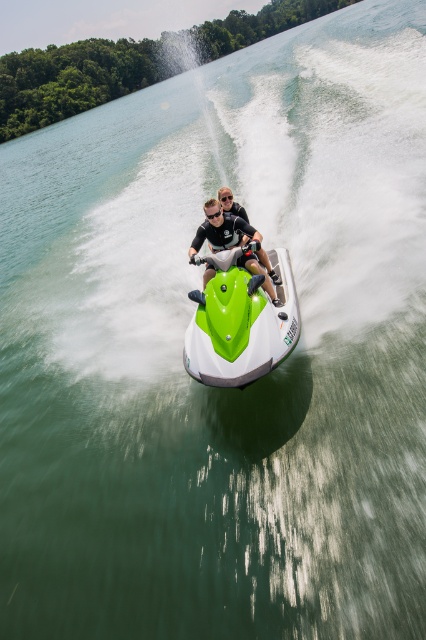
Question: From the image, what is the correct spatial relationship of green matte jet ski at center in relation to matte black helmet at center?

Choices:
 (A) below
 (B) above

Answer: (A)

Question: Is green matte jet ski at center bigger than matte black helmet at center?

Choices:
 (A) yes
 (B) no

Answer: (A)

Question: Which point is closer to the camera taking this photo?

Choices:
 (A) pyautogui.click(x=284, y=284)
 (B) pyautogui.click(x=201, y=230)

Answer: (B)

Question: Does green matte jet ski at center have a larger size compared to matte black helmet at center?

Choices:
 (A) yes
 (B) no

Answer: (A)

Question: Which point is closer to the camera taking this photo?

Choices:
 (A) pyautogui.click(x=207, y=364)
 (B) pyautogui.click(x=258, y=243)

Answer: (A)